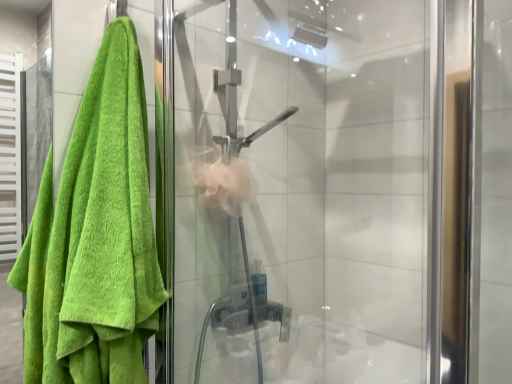
Locate an element on the screen. This screenshot has width=512, height=384. transparent glass shower door at center is located at coordinates (300, 191).

This screenshot has width=512, height=384. What do you see at coordinates (300, 191) in the screenshot?
I see `transparent glass shower door at center` at bounding box center [300, 191].

Where is `green terry cloth towel at left`? green terry cloth towel at left is located at coordinates (97, 236).

Image resolution: width=512 pixels, height=384 pixels. What do you see at coordinates (97, 236) in the screenshot?
I see `green terry cloth towel at left` at bounding box center [97, 236].

Image resolution: width=512 pixels, height=384 pixels. In order to click on transparent glass shower door at center in this screenshot , I will do `click(300, 191)`.

Which is more to the left, transparent glass shower door at center or green terry cloth towel at left?

green terry cloth towel at left.

Is the position of transparent glass shower door at center less distant than that of green terry cloth towel at left?

No, the depth of transparent glass shower door at center is greater than that of green terry cloth towel at left.

Which is nearer, (267, 355) or (122, 272)?

Point (267, 355) is farther from the camera than point (122, 272).

From the image's perspective, which is above, transparent glass shower door at center or green terry cloth towel at left?

transparent glass shower door at center, from the image's perspective.

From a real-world perspective, is transparent glass shower door at center located beneath green terry cloth towel at left?

Incorrect, from a real-world perspective, transparent glass shower door at center is higher than green terry cloth towel at left.

Between transparent glass shower door at center and green terry cloth towel at left, which one has smaller width?

green terry cloth towel at left is thinner.

Who is shorter, transparent glass shower door at center or green terry cloth towel at left?

green terry cloth towel at left is shorter.

Who is bigger, transparent glass shower door at center or green terry cloth towel at left?

Bigger between the two is transparent glass shower door at center.

Can we say transparent glass shower door at center lies outside green terry cloth towel at left?

Yes, transparent glass shower door at center is located beyond the bounds of green terry cloth towel at left.

Is transparent glass shower door at center directly adjacent to green terry cloth towel at left?

No, transparent glass shower door at center is not in contact with green terry cloth towel at left.

Is transparent glass shower door at center facing away from green terry cloth towel at left?

That's not correct — transparent glass shower door at center is not looking away from green terry cloth towel at left.

Can you tell me how much transparent glass shower door at center and green terry cloth towel at left differ in facing direction?

2.16 degrees.

Measure the distance between transparent glass shower door at center and green terry cloth towel at left.

They are 17.29 inches apart.

Where is `screen door lying on the right of green terry cloth towel at left`? screen door lying on the right of green terry cloth towel at left is located at coordinates (300, 191).

Does green terry cloth towel at left appear on the right side of transparent glass shower door at center?

No.

Which is behind, green terry cloth towel at left or transparent glass shower door at center?

transparent glass shower door at center.

Does point (99, 306) come farther from viewer compared to point (411, 156)?

No, (99, 306) is closer to viewer.

From the image's perspective, which one is positioned lower, green terry cloth towel at left or transparent glass shower door at center?

green terry cloth towel at left.

From a real-world perspective, is green terry cloth towel at left on top of transparent glass shower door at center?

No, from a real-world perspective, green terry cloth towel at left is not above transparent glass shower door at center.

Which of these two, green terry cloth towel at left or transparent glass shower door at center, is thinner?

green terry cloth towel at left.

Who is taller, green terry cloth towel at left or transparent glass shower door at center?

transparent glass shower door at center is taller.

Can you confirm if green terry cloth towel at left is smaller than transparent glass shower door at center?

Correct, green terry cloth towel at left occupies less space than transparent glass shower door at center.

Is green terry cloth towel at left inside the boundaries of transparent glass shower door at center, or outside?

green terry cloth towel at left is not enclosed by transparent glass shower door at center.

Is green terry cloth towel at left far from transparent glass shower door at center?

No, green terry cloth towel at left is not far away from transparent glass shower door at center.

Could you tell me if green terry cloth towel at left is facing transparent glass shower door at center?

No, green terry cloth towel at left is not turned towards transparent glass shower door at center.

Where is `screen door that appears on the right of green terry cloth towel at left`? This screenshot has height=384, width=512. screen door that appears on the right of green terry cloth towel at left is located at coordinates (300, 191).

Locate an element on the screen. screen door above the green terry cloth towel at left (from a real-world perspective) is located at coordinates (300, 191).

This screenshot has width=512, height=384. In order to click on towel located below the transparent glass shower door at center (from the image's perspective) in this screenshot , I will do `click(97, 236)`.